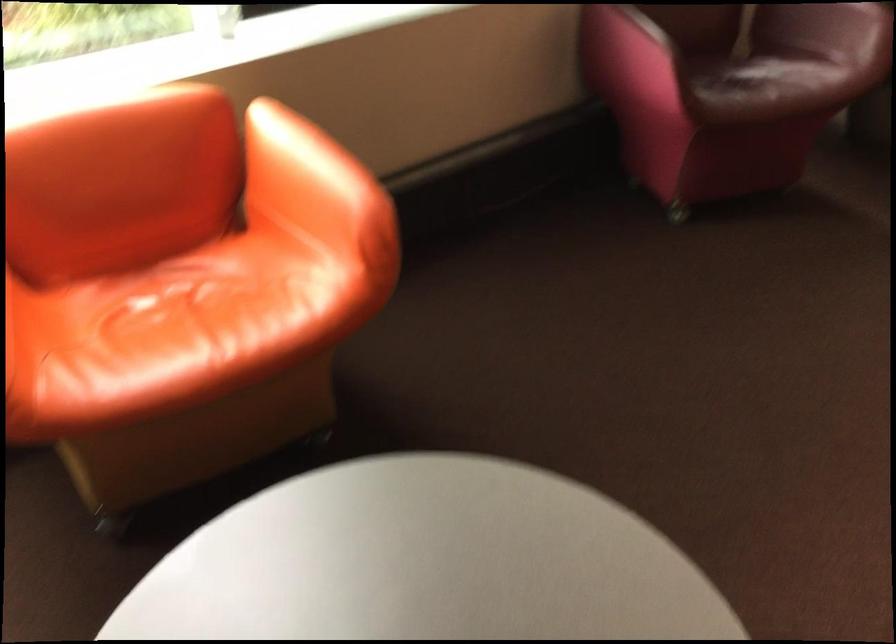
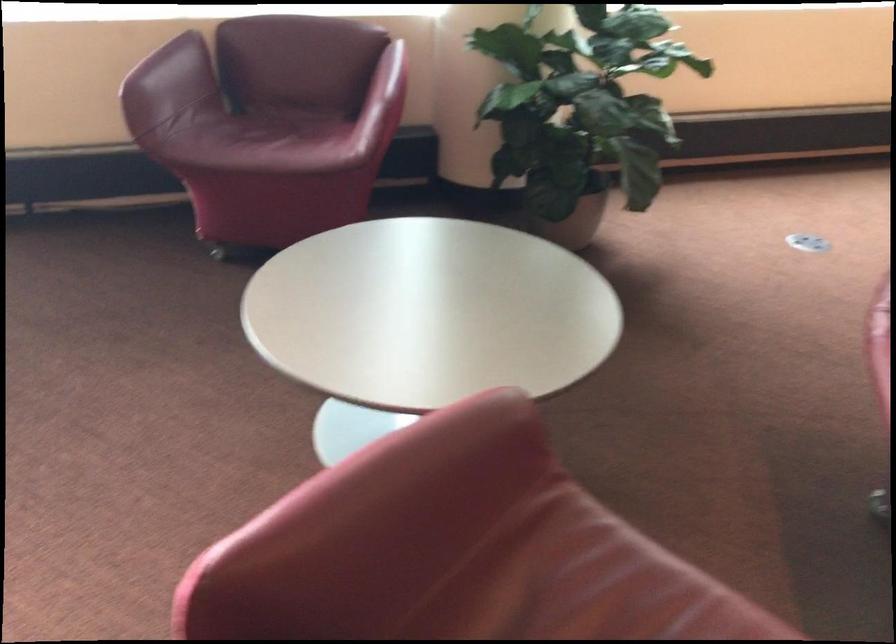
In the second image, find the point that corresponds to point 761,79 in the first image.

(263, 140)